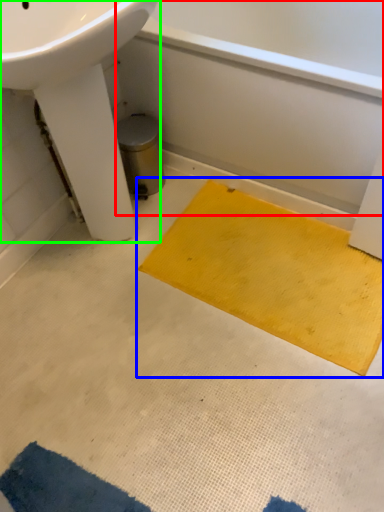
Question: Which object is the closest to the bath (highlighted by a red box)? Choose among these: doormat (highlighted by a blue box) or sink (highlighted by a green box).

Choices:
 (A) doormat
 (B) sink

Answer: (A)